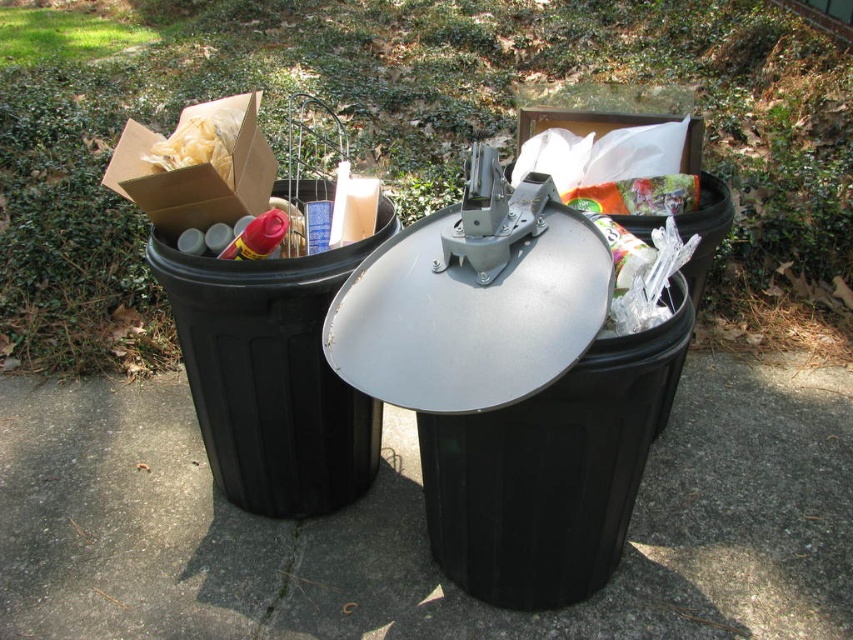
The width and height of the screenshot is (853, 640). I want to click on black plastic bin at left, so click(x=271, y=376).

Can you confirm if black plastic bin at left is positioned to the right of clear plastic bag at center?

In fact, black plastic bin at left is to the left of clear plastic bag at center.

Is point (354, 417) in front of point (659, 216)?

No, (354, 417) is further to viewer.

Identify the location of black plastic bin at left. Image resolution: width=853 pixels, height=640 pixels. (271, 376).

Who is shorter, black plastic pavement at center or white paper at upper left?

With less height is white paper at upper left.

Based on the photo, who is positioned more to the left, black plastic pavement at center or white paper at upper left?

From the viewer's perspective, white paper at upper left appears more on the left side.

Is point (96, 588) farther from camera compared to point (196, 132)?

Yes, it is.

You are a GUI agent. You are given a task and a screenshot of the screen. Output one action in this format:
    pyautogui.click(x=<x>, y=<y>)
    Task: Click on the black plastic pavement at center
    The width and height of the screenshot is (853, 640).
    Given the screenshot: What is the action you would take?
    pyautogui.click(x=418, y=525)

The width and height of the screenshot is (853, 640). Describe the element at coordinates (271, 376) in the screenshot. I see `black plastic bin at left` at that location.

Measure the distance between black plastic bin at left and white paper at upper left.

20.47 inches

Which is in front, point (213, 464) or point (157, 147)?

Point (157, 147) is more forward.

Locate an element on the screen. black plastic bin at left is located at coordinates (271, 376).